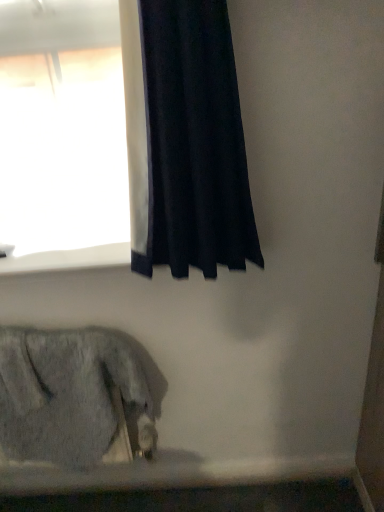
Question: Are white smooth window sill at upper left and fuzzy gray cat at lower left far apart?

Choices:
 (A) no
 (B) yes

Answer: (A)

Question: Does white smooth window sill at upper left have a smaller size compared to fuzzy gray cat at lower left?

Choices:
 (A) yes
 (B) no

Answer: (A)

Question: Is white smooth window sill at upper left wider than fuzzy gray cat at lower left?

Choices:
 (A) yes
 (B) no

Answer: (A)

Question: Can you confirm if white smooth window sill at upper left is shorter than fuzzy gray cat at lower left?

Choices:
 (A) yes
 (B) no

Answer: (A)

Question: From the image's perspective, does white smooth window sill at upper left appear lower than fuzzy gray cat at lower left?

Choices:
 (A) yes
 (B) no

Answer: (B)

Question: Does white smooth window sill at upper left contain fuzzy gray cat at lower left?

Choices:
 (A) yes
 (B) no

Answer: (B)

Question: Can you confirm if fuzzy gray cat at lower left is bigger than white smooth window sill at upper left?

Choices:
 (A) yes
 (B) no

Answer: (A)

Question: Is white smooth window sill at upper left surrounded by fuzzy gray cat at lower left?

Choices:
 (A) yes
 (B) no

Answer: (B)

Question: Could you tell me if fuzzy gray cat at lower left is facing white smooth window sill at upper left?

Choices:
 (A) yes
 (B) no

Answer: (B)

Question: Considering the relative sizes of fuzzy gray cat at lower left and white smooth window sill at upper left in the image provided, is fuzzy gray cat at lower left thinner than white smooth window sill at upper left?

Choices:
 (A) yes
 (B) no

Answer: (A)

Question: Would you say fuzzy gray cat at lower left is outside white smooth window sill at upper left?

Choices:
 (A) yes
 (B) no

Answer: (A)

Question: Can you confirm if fuzzy gray cat at lower left is taller than white smooth window sill at upper left?

Choices:
 (A) no
 (B) yes

Answer: (B)

Question: Considering the relative sizes of black velvet curtain at upper left and white smooth window sill at upper left in the image provided, is black velvet curtain at upper left wider than white smooth window sill at upper left?

Choices:
 (A) yes
 (B) no

Answer: (B)